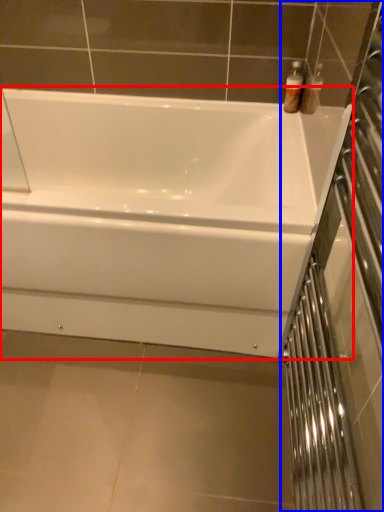
Question: Which object appears closest to the camera in this image, bathtub (highlighted by a red box) or screen door (highlighted by a blue box)?

Choices:
 (A) bathtub
 (B) screen door

Answer: (B)